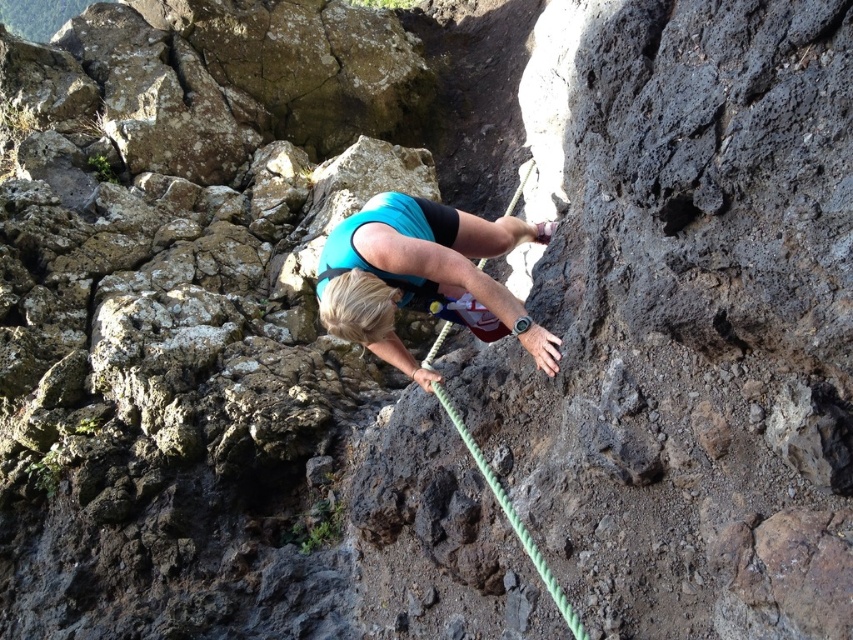
Does blue fabric climber at center appear over green rope at center?

Yes, blue fabric climber at center is above green rope at center.

How much distance is there between blue fabric climber at center and green rope at center?

The distance of blue fabric climber at center from green rope at center is 22.99 inches.

Is point (437, 205) closer to camera compared to point (549, 586)?

No.

At what (x,y) coordinates should I click in order to perform the action: click on blue fabric climber at center. Please return your answer as a coordinate pair (x, y). This screenshot has height=640, width=853. Looking at the image, I should click on (424, 276).